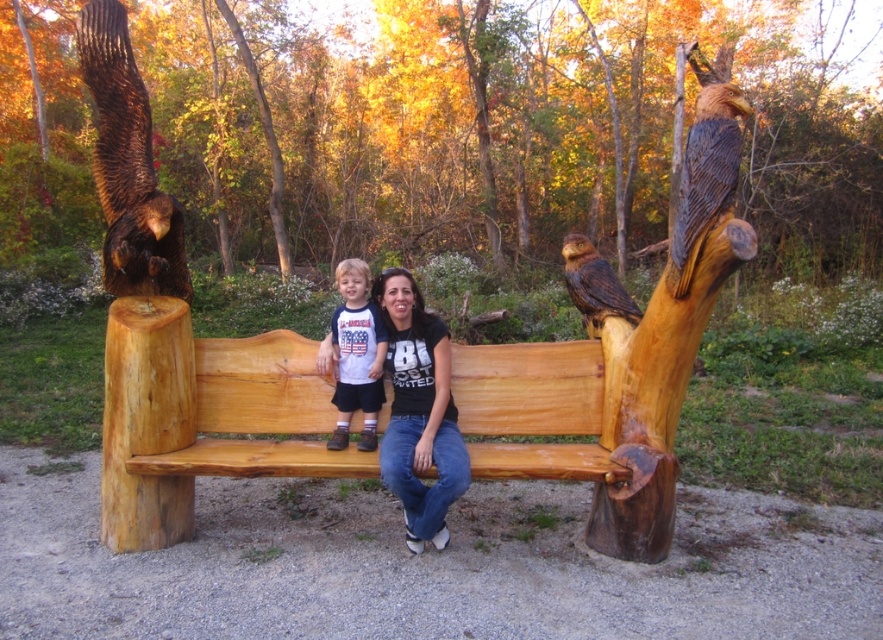
Who is lower down, natural wood bench at center or brown wood carving of owl at left?

Positioned lower is natural wood bench at center.

Image resolution: width=883 pixels, height=640 pixels. I want to click on natural wood bench at center, so click(602, 403).

Measure the distance between natural wood bench at center and camera.

natural wood bench at center is 9.95 feet from camera.

Locate an element on the screen. This screenshot has height=640, width=883. natural wood bench at center is located at coordinates (602, 403).

Does brown wood carving of owl at left lie in front of brown wood carving of owl at upper right?

That is False.

I want to click on brown wood carving of owl at left, so click(127, 164).

Find the location of `brown wood carving of owl at left`. brown wood carving of owl at left is located at coordinates (127, 164).

Measure the distance between brown wood carving of owl at left and camera.

brown wood carving of owl at left and camera are 3.25 meters apart.

Does brown wood carving of owl at left appear over brown wood owl at center?

Indeed, brown wood carving of owl at left is positioned over brown wood owl at center.

Is point (125, 61) closer to camera compared to point (620, 292)?

Yes, it is.

The width and height of the screenshot is (883, 640). I want to click on brown wood carving of owl at left, so click(x=127, y=164).